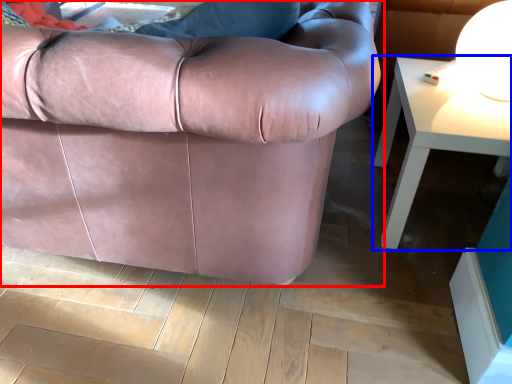
Question: Among these objects, which one is nearest to the camera, studio couch (highlighted by a red box) or table (highlighted by a blue box)?

Choices:
 (A) studio couch
 (B) table

Answer: (A)